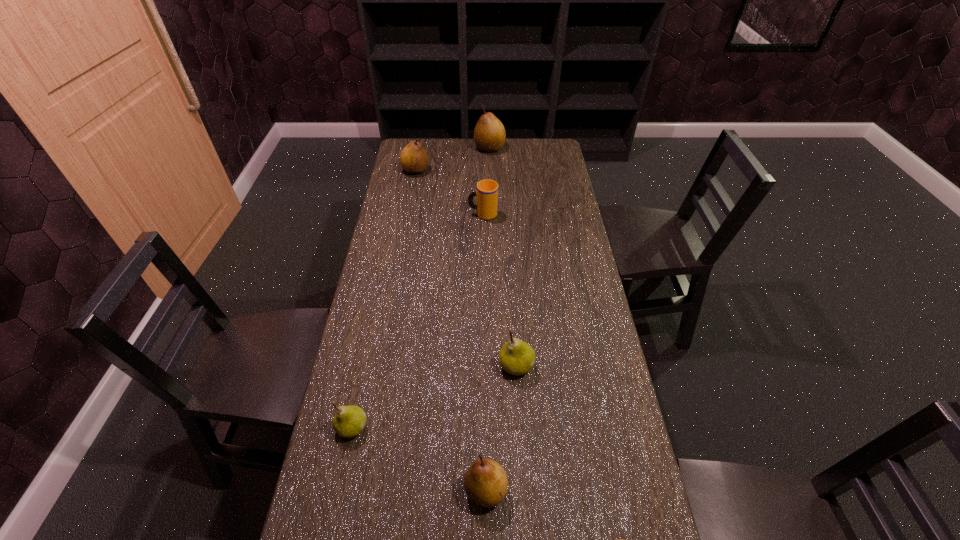
This screenshot has width=960, height=540. In order to click on the tallest object in this screenshot , I will do `click(489, 135)`.

Where is `the tallest pear`? the tallest pear is located at coordinates (489, 135).

Locate an element on the screen. The width and height of the screenshot is (960, 540). the second farthest object is located at coordinates (414, 159).

Where is `the leftmost brown pear`? This screenshot has width=960, height=540. the leftmost brown pear is located at coordinates (414, 159).

Find the location of a particular element. This screenshot has width=960, height=540. the bigger green pear is located at coordinates (516, 357).

At what (x,y) coordinates should I click in order to perform the action: click on the farther green pear. Please return your answer as a coordinate pair (x, y). The height and width of the screenshot is (540, 960). Looking at the image, I should click on (516, 357).

Identify the location of the fifth nearest object. (487, 190).

Locate an element on the screen. This screenshot has width=960, height=540. cup is located at coordinates (487, 190).

This screenshot has height=540, width=960. I want to click on the third biggest brown pear, so click(x=486, y=483).

At what (x,y) coordinates should I click in order to perform the action: click on the sixth farthest object. Please return your answer as a coordinate pair (x, y). This screenshot has height=540, width=960. Looking at the image, I should click on (486, 483).